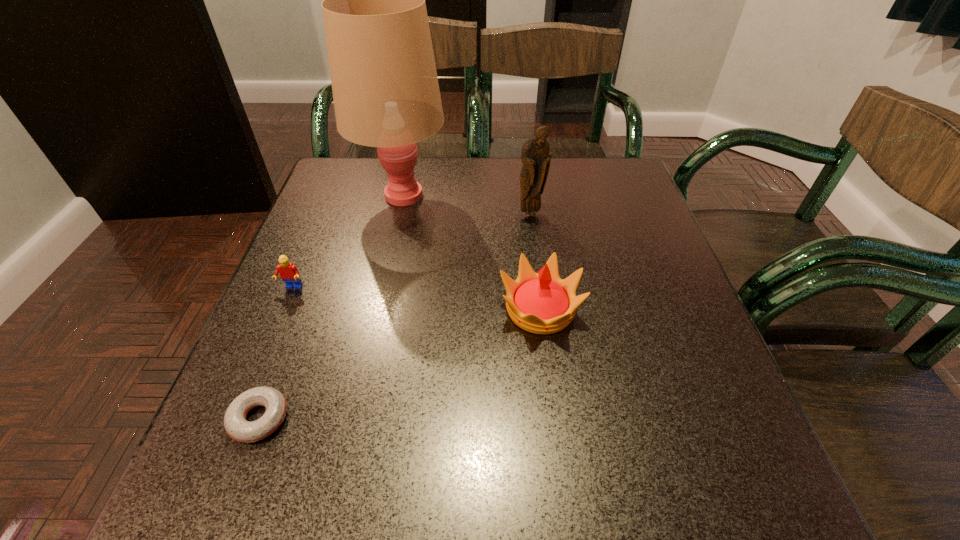
The image size is (960, 540). Identify the location of blank area located 0.300m on the right of the shortest object. (480, 418).

I want to click on object located at the far edge, so click(x=386, y=94).

Where is `lampshade situated at the left edge`? The image size is (960, 540). lampshade situated at the left edge is located at coordinates (386, 94).

Find the location of a particular element. Image resolution: width=960 pixels, height=540 pixels. Lego that is at the left edge is located at coordinates (289, 274).

Locate an element on the screen. This screenshot has height=540, width=960. doughnut at the left edge is located at coordinates (237, 427).

Where is `object present at the far left corner`? object present at the far left corner is located at coordinates (386, 94).

I want to click on blank space at the far edge of the desktop, so click(469, 193).

You are a GUI agent. You are given a task and a screenshot of the screen. Output one action in this format:
    pyautogui.click(x=<x>, y=<y>)
    Task: Click on the free region at the near edge
    
    Given the screenshot: What is the action you would take?
    (607, 482)

I want to click on free region at the left edge, so click(x=339, y=212).

Where is `free space at the right edge`? The height and width of the screenshot is (540, 960). free space at the right edge is located at coordinates (x=674, y=275).